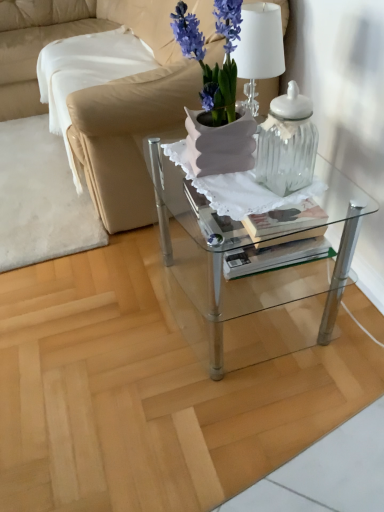
Image resolution: width=384 pixels, height=512 pixels. Find the location of `vacant space that is in between beige leather couch at upper left and clear glass table at center`. vacant space that is in between beige leather couch at upper left and clear glass table at center is located at coordinates (112, 295).